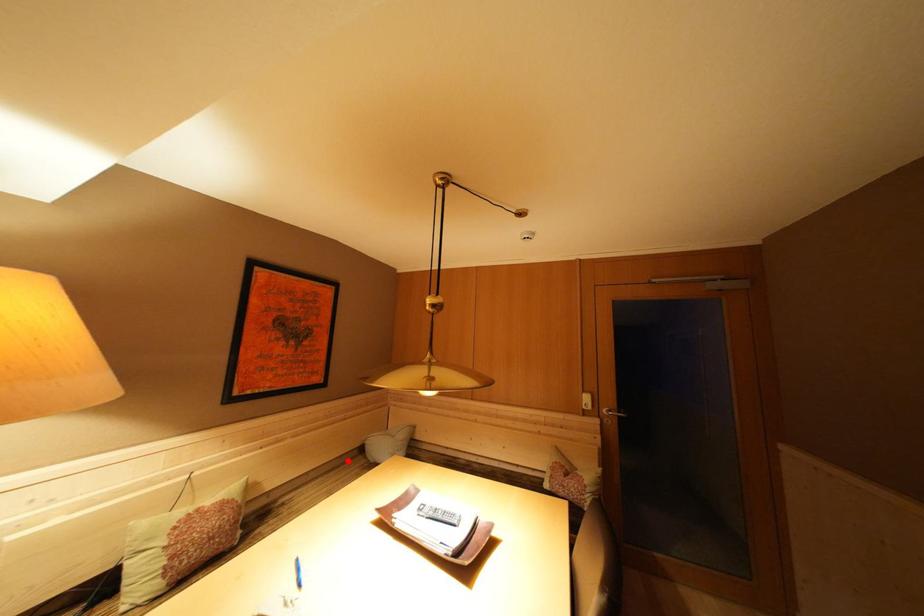
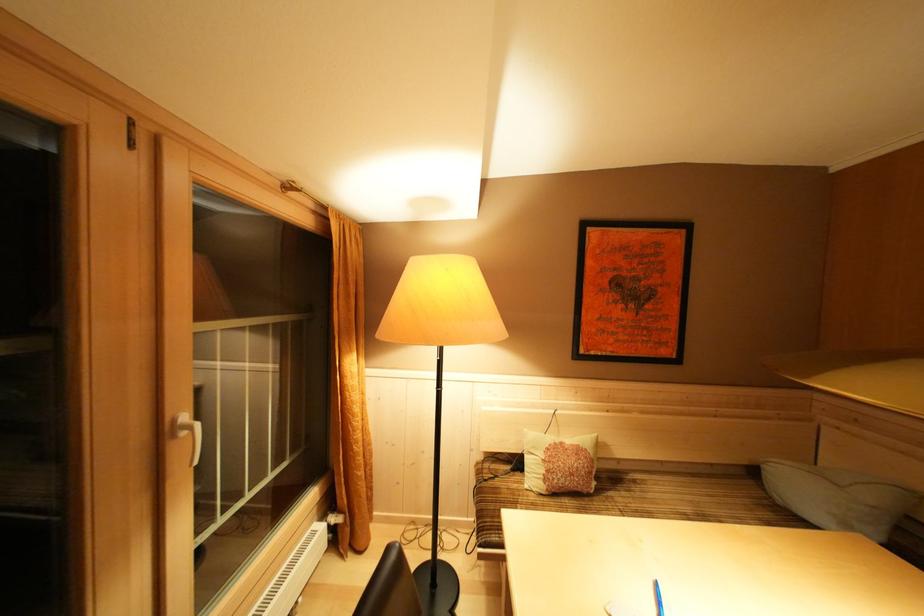
Question: A red point is marked in image1. In image2, is the corresponding 3D point closer to the camera or farther? Reply with the corresponding letter.

Choices:
 (A) The corresponding 3D point is closer.
 (B) The corresponding 3D point is farther.

Answer: (A)